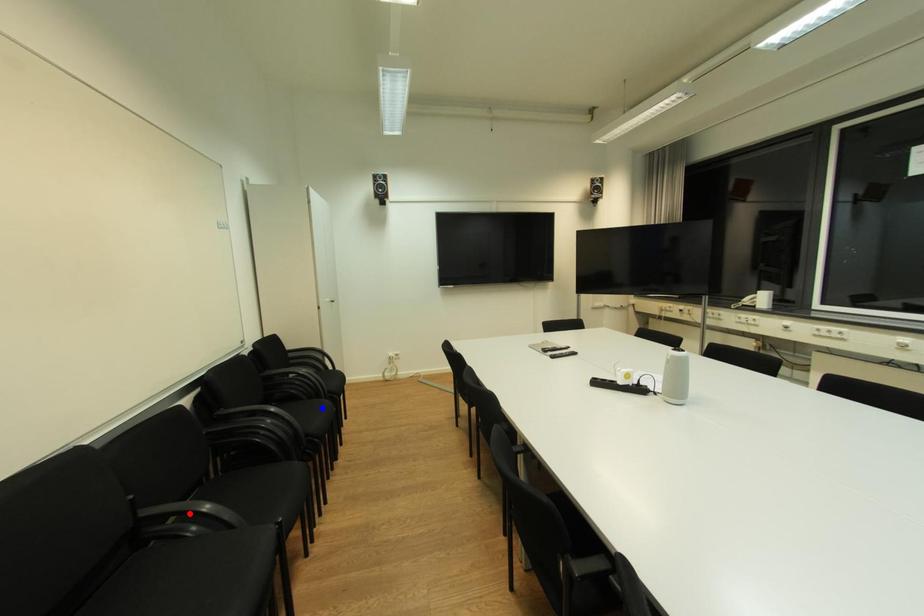
Question: Two points are marked on the image. Which point is closer to the camera?

Choices:
 (A) Blue point is closer.
 (B) Red point is closer.

Answer: (B)